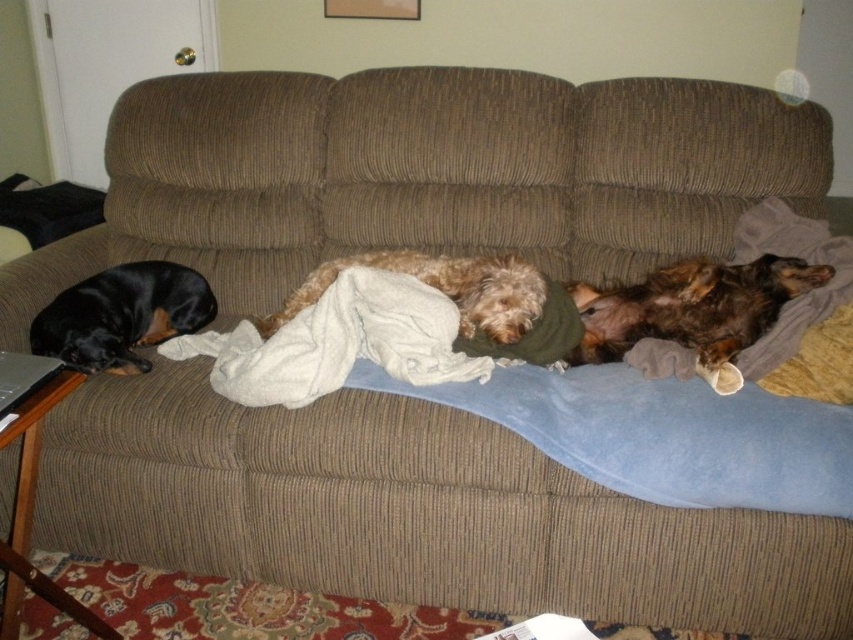
Where is the black smooth dog at left located in the image?

The black smooth dog at left is located at point 0.494 on the x axis and 0.143 on the y axis.

You are a photographer trying to capture a photo of both the brown shaggy dog at right and the black smooth dog at left. Since you want to include both in the frame, should you position yourself to the left or right of the couch?

You should position yourself to the left of the couch to ensure both the brown shaggy dog at right and the black smooth dog at left are in the frame. Since the brown shaggy dog at right is to the right of the black smooth dog at left, positioning yourself to the left will allow you to capture both dogs in the same shot.

You are a dog owner who wants to place a new toy between the brown shaggy dog at right and the fuzzy brown dog at center. Based on their positions, which dog is closer to the front of the couch?

The brown shaggy dog at right is closer to the front of the couch because the fuzzy brown dog at center is behind it.